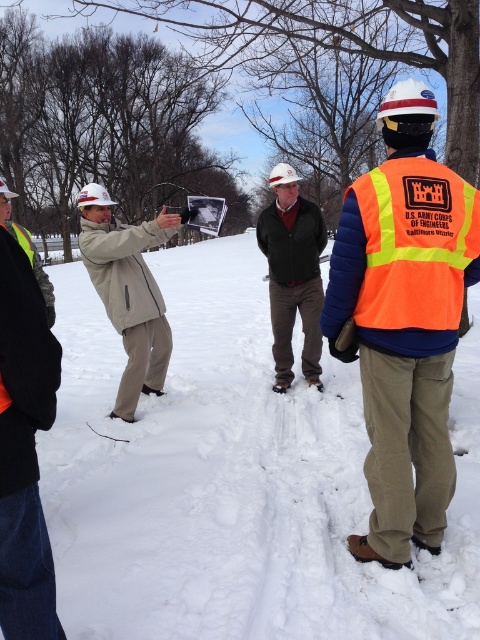
Question: Which object appears closest to the camera in this image?

Choices:
 (A) orange reflective vest at center
 (B) orange reflective safety vest at center-right
 (C) white powdery snow at center
 (D) beige fabric jacket at center

Answer: (C)

Question: Among these objects, which one is farthest from the camera?

Choices:
 (A) orange reflective vest at center
 (B) beige fabric jacket at center
 (C) white powdery snow at center
 (D) orange reflective safety vest at center-right

Answer: (B)

Question: Which object is positioned closest to the orange reflective safety vest at center-right?

Choices:
 (A) orange reflective vest at center
 (B) beige fabric jacket at center
 (C) white powdery snow at center
 (D) green matte jacket at center

Answer: (A)

Question: Can you confirm if orange reflective safety vest at center-right is positioned to the left of beige fabric jacket at center?

Choices:
 (A) yes
 (B) no

Answer: (B)

Question: Can you confirm if white powdery snow at center is positioned to the left of orange reflective vest at center?

Choices:
 (A) no
 (B) yes

Answer: (B)

Question: Where is white powdery snow at center located in relation to orange reflective vest at center in the image?

Choices:
 (A) right
 (B) left

Answer: (B)